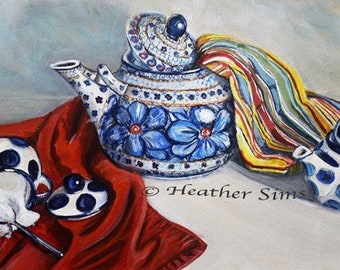
Where is `spoon`? The width and height of the screenshot is (340, 270). spoon is located at coordinates (21, 228).